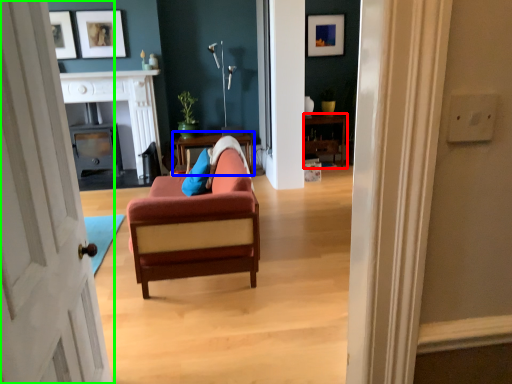
Question: Based on their relative distances, which object is farther from dresser (highlighted by a red box)? Choose from table (highlighted by a blue box) and door (highlighted by a green box).

Choices:
 (A) table
 (B) door

Answer: (B)